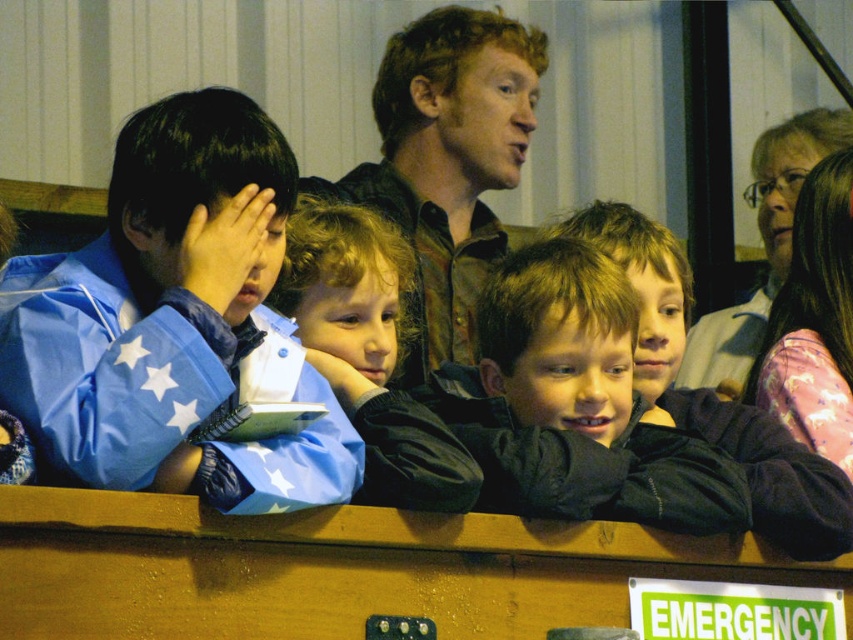
Question: Which point appears closest to the camera in this image?

Choices:
 (A) (111, 406)
 (B) (778, 468)

Answer: (A)

Question: Which object is positioned farthest from the dark brown velvety jacket at center?

Choices:
 (A) light brown hair at center
 (B) dark brown fabric jacket at center
 (C) pink satin dress at right

Answer: (C)

Question: Does light brown hair at center come behind dark brown velvety jacket at center?

Choices:
 (A) yes
 (B) no

Answer: (A)

Question: Considering the real-world distances, which object is closest to the dark brown fabric jacket at center?

Choices:
 (A) dark brown velvety jacket at center
 (B) blue matte jacket at left
 (C) pink satin dress at right

Answer: (A)

Question: Can you confirm if blue matte jacket at left is wider than pink satin dress at right?

Choices:
 (A) no
 (B) yes

Answer: (A)

Question: Does light brown hair at center appear over pink satin dress at right?

Choices:
 (A) yes
 (B) no

Answer: (B)